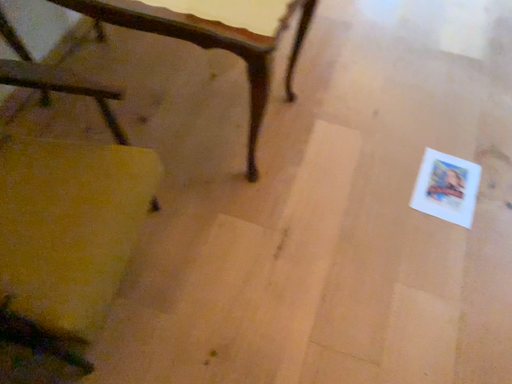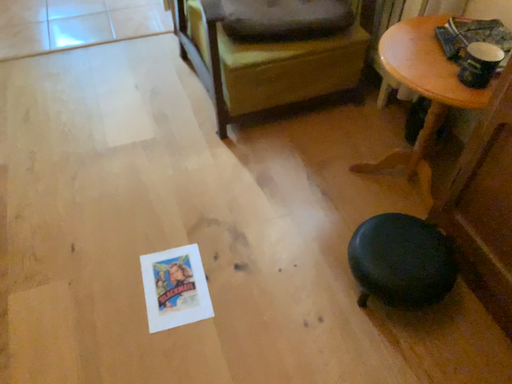
Question: How did the camera likely rotate when shooting the video?

Choices:
 (A) rotated left
 (B) rotated right

Answer: (B)